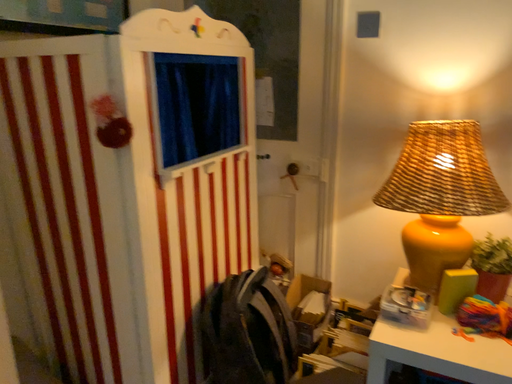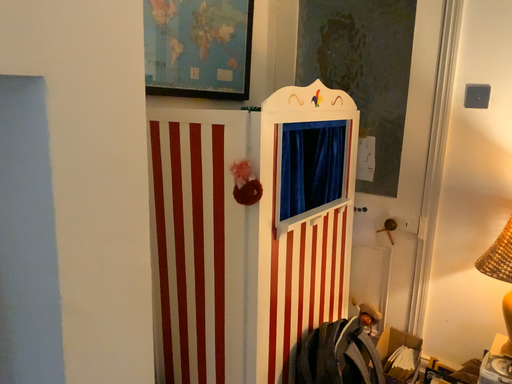
Question: How did the camera likely rotate when shooting the video?

Choices:
 (A) rotated left
 (B) rotated right

Answer: (A)